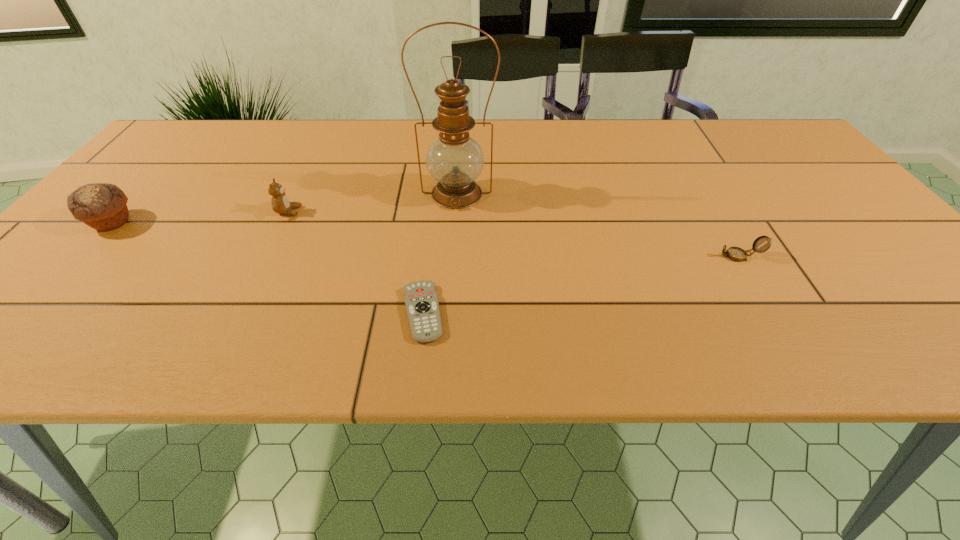
Where is `vacant region at the right edge of the desktop`? vacant region at the right edge of the desktop is located at coordinates (849, 259).

The width and height of the screenshot is (960, 540). In order to click on free space at the near left corner of the desktop in this screenshot , I will do `click(48, 353)`.

Find the location of a particular element. vacant space that is in between the third shortest object and the rightmost object is located at coordinates (514, 234).

Identify the location of free space between the fourth tallest object and the third tallest object. (514, 234).

The image size is (960, 540). Identify the location of free spot between the compass and the leftmost object. (426, 239).

Locate an element on the screen. free area in between the oil lamp and the second object from left to right is located at coordinates (372, 202).

Locate an element on the screen. The width and height of the screenshot is (960, 540). vacant space in between the teddy bear and the oil lamp is located at coordinates (372, 202).

Where is `empty space that is in between the muffin and the fourth farthest object`? Image resolution: width=960 pixels, height=540 pixels. empty space that is in between the muffin and the fourth farthest object is located at coordinates (426, 239).

Where is `free space between the leftmost object and the remote control`? The image size is (960, 540). free space between the leftmost object and the remote control is located at coordinates (267, 267).

Find the location of `blank region between the teddy bear and the tallest object`. blank region between the teddy bear and the tallest object is located at coordinates (372, 202).